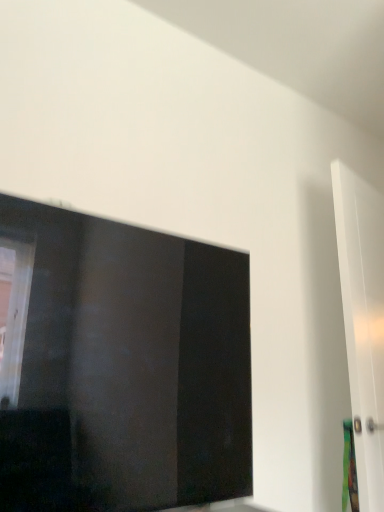
Measure the distance between point (358, 396) and camera.

The depth of point (358, 396) is 4.67 feet.

Describe the element at coordinates (363, 322) in the screenshot. I see `white glossy door at right` at that location.

Locate an element on the screen. white glossy door at right is located at coordinates (363, 322).

Where is `transparent glass window at upper left`? The width and height of the screenshot is (384, 512). transparent glass window at upper left is located at coordinates (120, 365).

The height and width of the screenshot is (512, 384). What do you see at coordinates (120, 365) in the screenshot?
I see `transparent glass window at upper left` at bounding box center [120, 365].

The image size is (384, 512). I want to click on white glossy door at right, so click(x=363, y=322).

Is white glossy door at right to the right of transparent glass window at upper left from the viewer's perspective?

Correct, you'll find white glossy door at right to the right of transparent glass window at upper left.

In the image, is white glossy door at right positioned in front of or behind transparent glass window at upper left?

white glossy door at right is positioned farther from the viewer than transparent glass window at upper left.

Is point (365, 185) farther from camera compared to point (36, 294)?

Yes, it is behind point (36, 294).

From the image's perspective, which is above, white glossy door at right or transparent glass window at upper left?

transparent glass window at upper left.

From a real-world perspective, is white glossy door at right over transparent glass window at upper left?

Yes, from a real-world perspective, white glossy door at right is above transparent glass window at upper left.

Considering the sizes of white glossy door at right and transparent glass window at upper left in the image, is white glossy door at right wider or thinner than transparent glass window at upper left?

Considering their sizes, white glossy door at right looks slimmer than transparent glass window at upper left.

Considering the relative sizes of white glossy door at right and transparent glass window at upper left in the image provided, is white glossy door at right shorter than transparent glass window at upper left?

In fact, white glossy door at right may be taller than transparent glass window at upper left.

Which of these two, white glossy door at right or transparent glass window at upper left, is smaller?

white glossy door at right.

Would you say transparent glass window at upper left is part of white glossy door at right's contents?

No, transparent glass window at upper left is not surrounded by white glossy door at right.

Is white glossy door at right positioned far away from transparent glass window at upper left?

No, there isn't a large distance between white glossy door at right and transparent glass window at upper left.

Is white glossy door at right oriented away from transparent glass window at upper left?

No, white glossy door at right is not facing away from transparent glass window at upper left.

How many degrees apart are the facing directions of white glossy door at right and transparent glass window at upper left?

white glossy door at right and transparent glass window at upper left are facing 12 degrees away from each other.

This screenshot has width=384, height=512. In order to click on door behind the transparent glass window at upper left in this screenshot , I will do `click(363, 322)`.

Which is more to the left, transparent glass window at upper left or white glossy door at right?

Positioned to the left is transparent glass window at upper left.

In the scene shown: Does transparent glass window at upper left lie behind white glossy door at right?

No, the depth of transparent glass window at upper left is less than that of white glossy door at right.

Considering the positions of point (144, 394) and point (342, 221), is point (144, 394) closer or farther from the camera than point (342, 221)?

Point (144, 394) is closer to the camera than point (342, 221).

From the image's perspective, is transparent glass window at upper left below white glossy door at right?

No, from the image's perspective, transparent glass window at upper left is not below white glossy door at right.

From a real-world perspective, is transparent glass window at upper left positioned under white glossy door at right based on gravity?

Correct, in the physical world, transparent glass window at upper left is lower than white glossy door at right.

Which of these two, transparent glass window at upper left or white glossy door at right, is wider?

transparent glass window at upper left.

Is transparent glass window at upper left taller or shorter than white glossy door at right?

Considering their sizes, transparent glass window at upper left has less height than white glossy door at right.

Consider the image. Does transparent glass window at upper left have a smaller size compared to white glossy door at right?

No, transparent glass window at upper left is not smaller than white glossy door at right.

Could white glossy door at right be considered to be inside transparent glass window at upper left?

Definitely not — white glossy door at right is not inside transparent glass window at upper left.

Are transparent glass window at upper left and white glossy door at right beside each other?

transparent glass window at upper left and white glossy door at right are not in contact.

Could you tell me if transparent glass window at upper left is facing white glossy door at right?

No, transparent glass window at upper left does not turn towards white glossy door at right.

Find the location of a particular element. The width and height of the screenshot is (384, 512). door above the transparent glass window at upper left (from a real-world perspective) is located at coordinates (363, 322).

Identify the location of door to the right of transparent glass window at upper left. (363, 322).

In order to click on window in front of the white glossy door at right in this screenshot , I will do `click(120, 365)`.